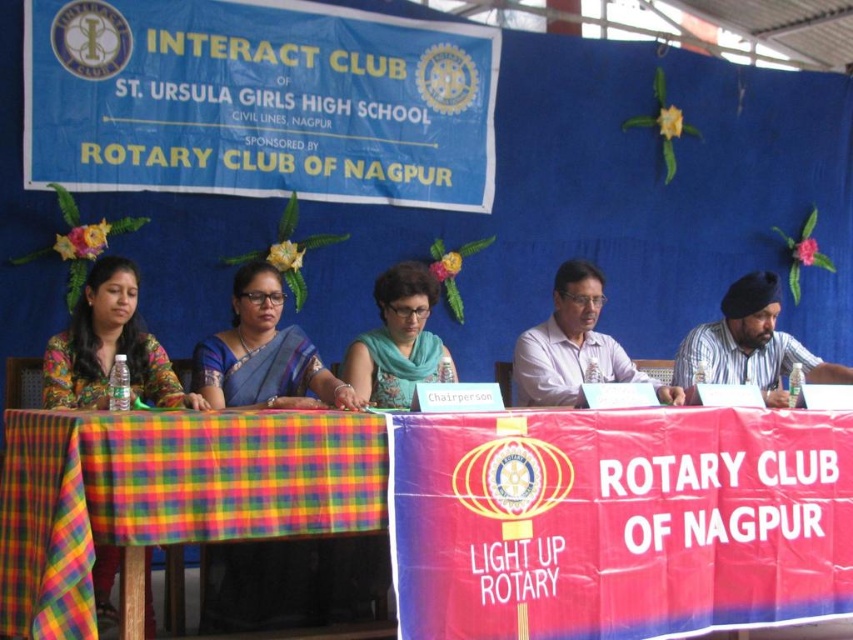
Is plaid fabric tablecloth at center bigger than matte floral dress at left?

Indeed, plaid fabric tablecloth at center has a larger size compared to matte floral dress at left.

Is point (247, 520) closer to camera compared to point (102, 376)?

Yes.

You are a GUI agent. You are given a task and a screenshot of the screen. Output one action in this format:
    pyautogui.click(x=<x>, y=<y>)
    Task: Click on the plaid fabric tablecloth at center
    
    Given the screenshot: What is the action you would take?
    pyautogui.click(x=451, y=509)

Which of these two, blue silk saree at center or white shirt at center, stands taller?

white shirt at center is taller.

Who is more forward, (363, 576) or (543, 388)?

Point (363, 576) is more forward.

What are the coordinates of `blue silk saree at center` in the screenshot? It's located at (264, 353).

Who is lower down, matte floral dress at left or striped shirt at right?

Positioned lower is matte floral dress at left.

Who is positioned more to the right, matte floral dress at left or striped shirt at right?

Positioned to the right is striped shirt at right.

Is point (165, 364) closer to viewer compared to point (727, 362)?

Yes, point (165, 364) is closer to viewer.

The height and width of the screenshot is (640, 853). Find the location of `matte floral dress at left`. matte floral dress at left is located at coordinates (109, 346).